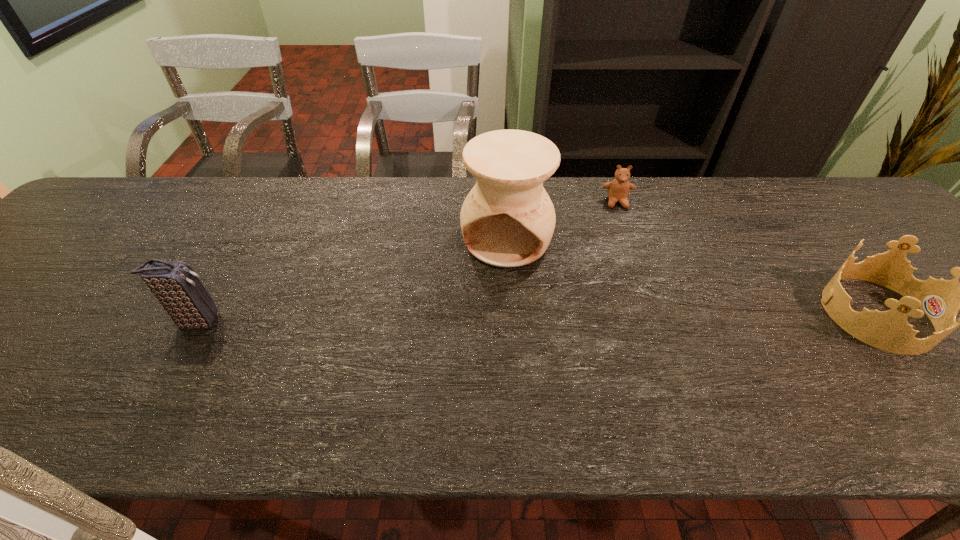
In order to click on vacant space in between the second object from left to right and the leftmost object in this screenshot , I will do `click(351, 280)`.

Image resolution: width=960 pixels, height=540 pixels. What are the coordinates of `free area in between the pottery and the leftmost object` in the screenshot? It's located at (351, 280).

Where is `free space between the third object from left to right and the tallest object`? This screenshot has width=960, height=540. free space between the third object from left to right and the tallest object is located at coordinates (562, 221).

At what (x,y) coordinates should I click in order to perform the action: click on vacant area between the leftmost object and the pottery. Please return your answer as a coordinate pair (x, y). Looking at the image, I should click on (351, 280).

Image resolution: width=960 pixels, height=540 pixels. In order to click on object that is the second closest to the rightmost object in this screenshot , I will do `click(507, 220)`.

Identify which object is located as the third nearest to the farthest object. Please provide its 2D coordinates. Your answer should be formatted as a tuple, i.e. [(x, y)], where the tuple contains the x and y coordinates of a point satisfying the conditions above.

[(177, 287)]